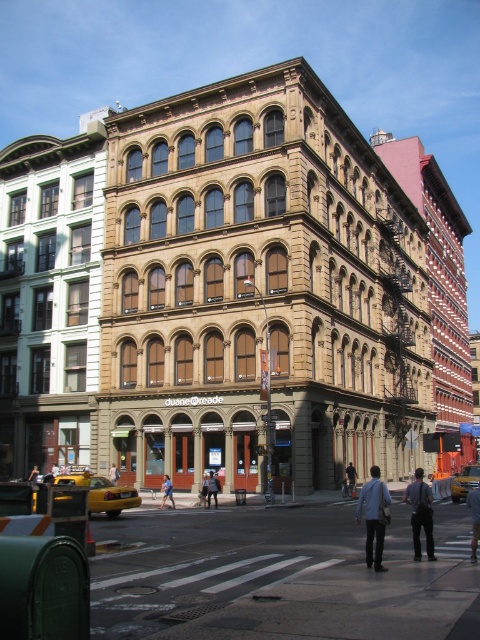
Question: Which point appears farthest from the camera in this image?

Choices:
 (A) (118, 468)
 (B) (219, 484)
 (C) (350, 481)
 (D) (165, 477)

Answer: (A)

Question: Is light blue denim jacket at center in front of denim jacket at lower center?

Choices:
 (A) yes
 (B) no

Answer: (A)

Question: Considering the real-world distances, which object is farthest from the dark gray suit at center?

Choices:
 (A) denim jacket at lower center
 (B) blue jeans at lower center
 (C) blue fabric shirt at center

Answer: (B)

Question: Among these objects, which one is farthest from the camera?

Choices:
 (A) denim jacket at lower center
 (B) dark blue jeans at center
 (C) dark gray suit at center

Answer: (B)

Question: Can you confirm if dark gray suit at center is positioned below blue jeans at lower center?

Choices:
 (A) yes
 (B) no

Answer: (B)

Question: Does blue fabric shirt at center appear on the right side of blue jeans at lower center?

Choices:
 (A) no
 (B) yes

Answer: (B)